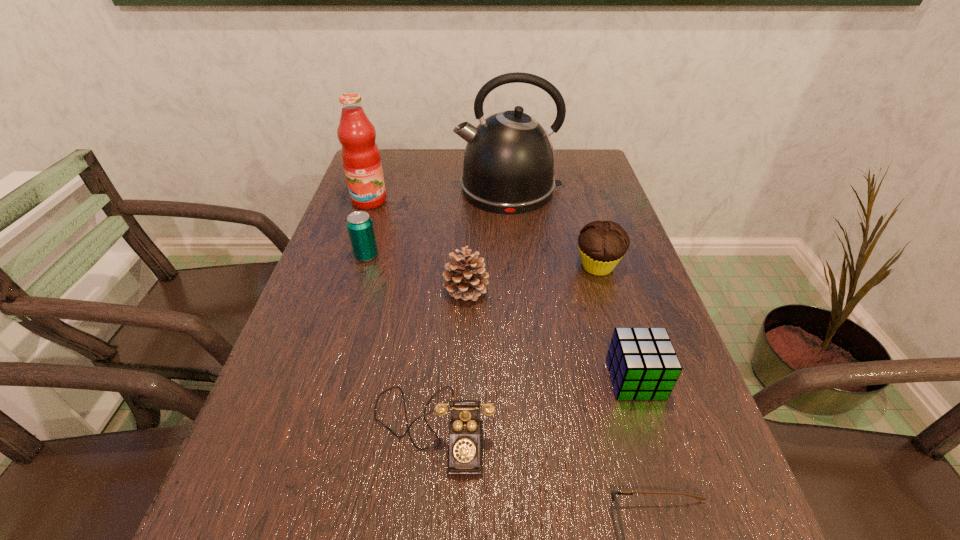
Identify the location of vacant point located between the beer can and the telephone. The height and width of the screenshot is (540, 960). (399, 342).

I want to click on vacant point located between the muffin and the pinecone, so click(x=532, y=279).

Where is `blank region between the telephone and the cube`? This screenshot has height=540, width=960. blank region between the telephone and the cube is located at coordinates (534, 404).

The width and height of the screenshot is (960, 540). I want to click on vacant space that is in between the pinecone and the kettle, so pos(487,240).

This screenshot has width=960, height=540. Find the location of `free spot between the telephone and the fruit juice`. free spot between the telephone and the fruit juice is located at coordinates (401, 315).

Locate which object ranks in proximity to the muffin. Please provide its 2D coordinates. Your answer should be formatted as a tuple, i.e. [(x, y)], where the tuple contains the x and y coordinates of a point satisfying the conditions above.

[(509, 162)]

Find the location of a particular element. This screenshot has width=960, height=540. object identified as the sixth closest to the beer can is located at coordinates (642, 362).

At what (x,y) coordinates should I click in order to perform the action: click on free point that satisfies the following two spatial constraints: 1. on the front label of the fruit juice; 2. on the left side of the beer can. Please return your answer as a coordinate pair (x, y). The width and height of the screenshot is (960, 540). Looking at the image, I should click on (350, 256).

Image resolution: width=960 pixels, height=540 pixels. In order to click on free point that satisfies the following two spatial constraints: 1. on the front label of the fruit juice; 2. on the right side of the pinecone in this screenshot , I will do `click(339, 291)`.

The height and width of the screenshot is (540, 960). Find the location of `vacant area in the image that satisfies the following two spatial constraints: 1. on the spout of the kettle; 2. on the back side of the muffin`. vacant area in the image that satisfies the following two spatial constraints: 1. on the spout of the kettle; 2. on the back side of the muffin is located at coordinates (516, 266).